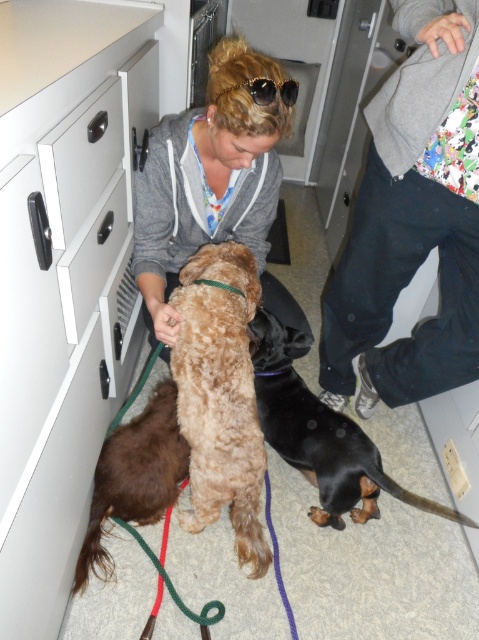
Can you confirm if white plastic file cabinet at left is shorter than black smooth dachshund at lower center?

In fact, white plastic file cabinet at left may be taller than black smooth dachshund at lower center.

Does point (57, 33) come farther from viewer compared to point (275, 388)?

No, (57, 33) is in front of (275, 388).

Identify the location of white plastic file cabinet at left. (57, 282).

Is black smooth dachshund at lower center shorter than brown fuzzy dog at lower left?

No, black smooth dachshund at lower center is not shorter than brown fuzzy dog at lower left.

Who is higher up, black smooth dachshund at lower center or brown fuzzy dog at lower left?

black smooth dachshund at lower center is above.

The height and width of the screenshot is (640, 479). Identify the location of black smooth dachshund at lower center. (319, 433).

How much distance is there between gray fleece sweater at upper center and white matte drawer at center left?

gray fleece sweater at upper center and white matte drawer at center left are 74.68 centimeters apart.

Does point (350, 291) come behind point (54, 227)?

Yes, point (350, 291) is farther from viewer.

Looking at this image, who is more distant from viewer, (340, 257) or (113, 90)?

The point (340, 257) is behind.

At what (x,y) coordinates should I click in order to perform the action: click on gray fleece sweater at upper center. Please return your answer as a coordinate pair (x, y). Looking at the image, I should click on (411, 221).